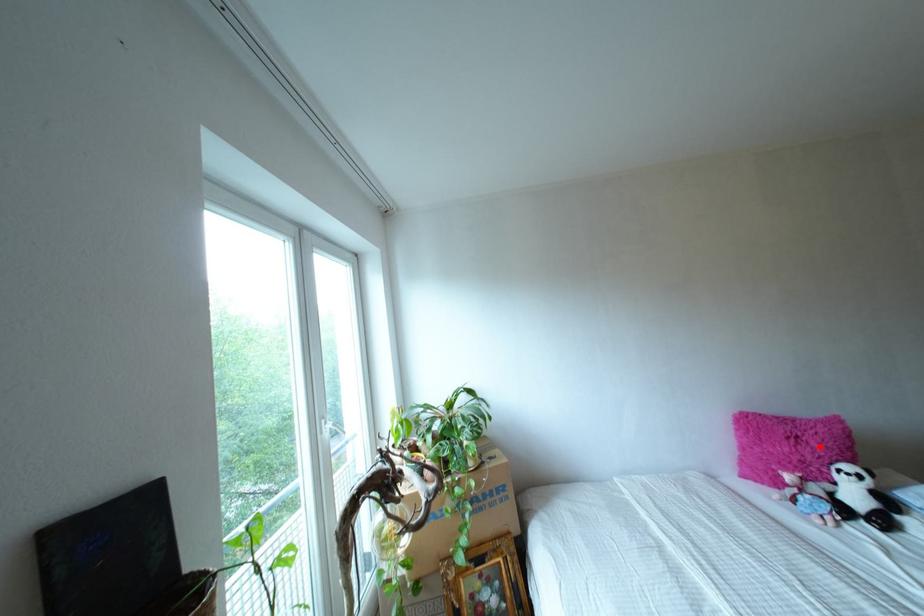
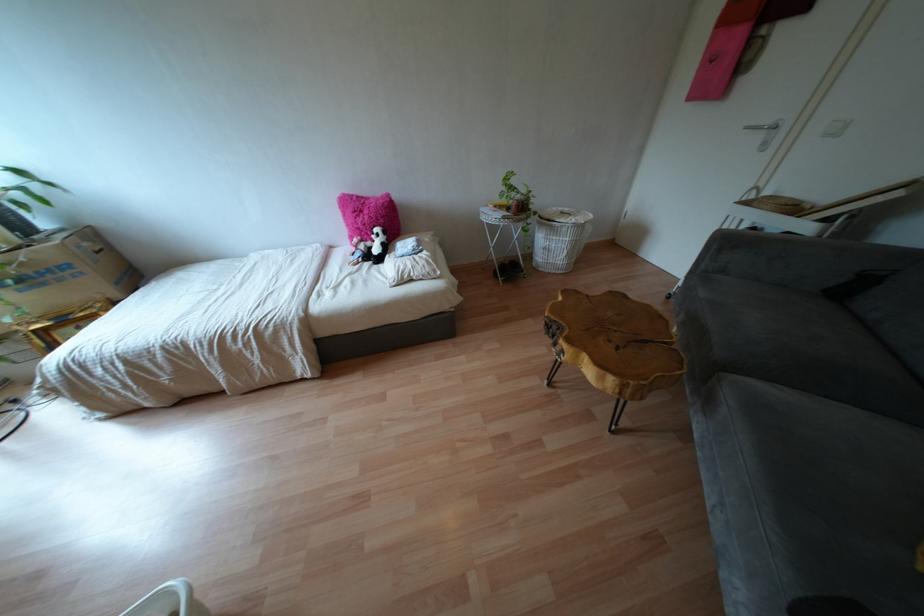
Question: I am providing you with two images of the same scene from different viewpoints. A red point is marked on the first image. At the location where the point appears in image 1, is it still visible in image 2?

Choices:
 (A) Yes
 (B) No

Answer: (A)